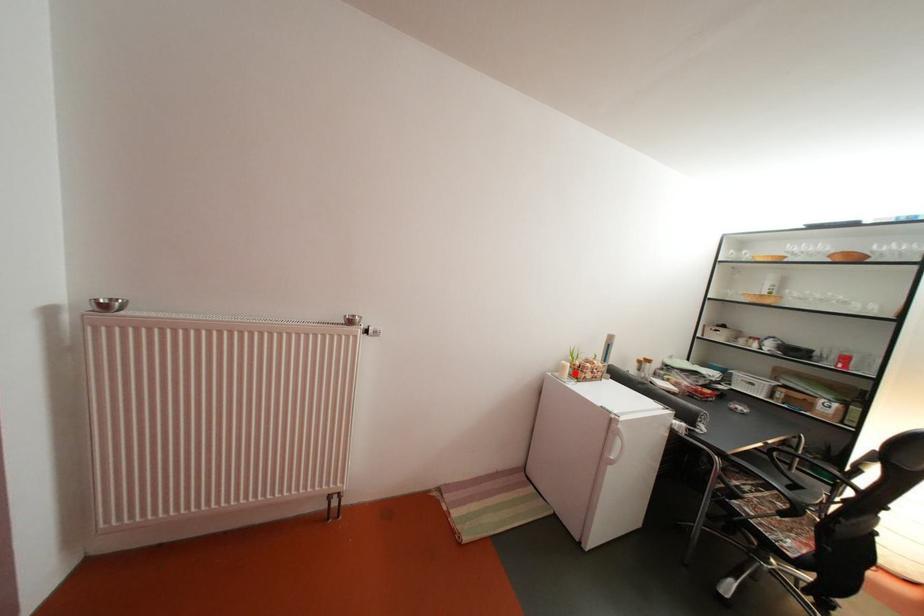
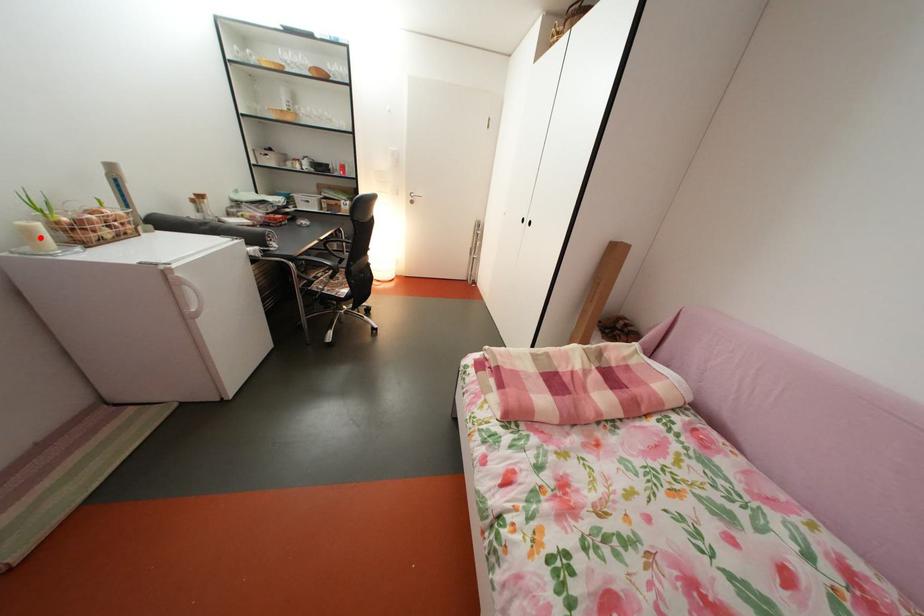
I am providing you with two images of the same scene from different viewpoints. A red point is marked on the first image and another point is marked on the second image. Is the red point in image1 aligned with the point shown in image2?

Yes